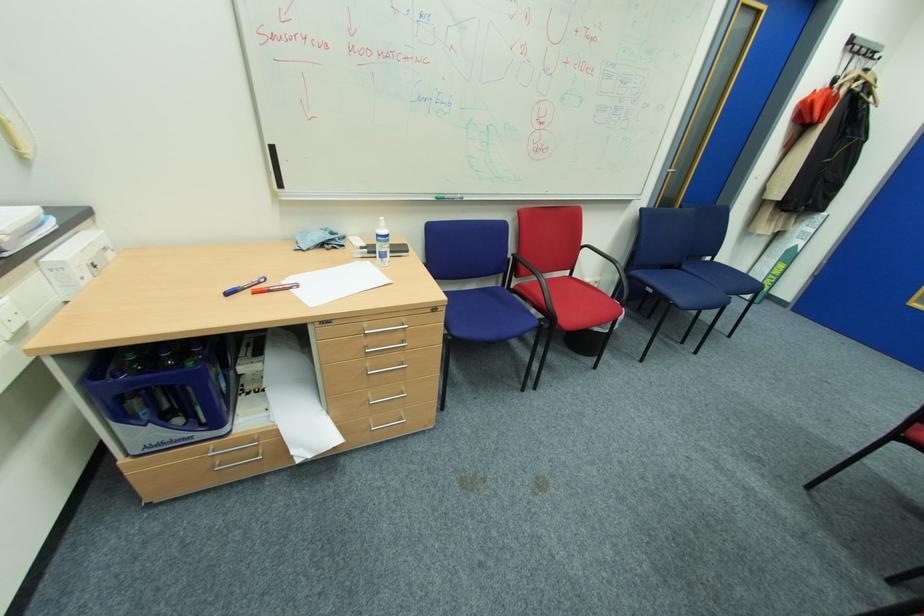
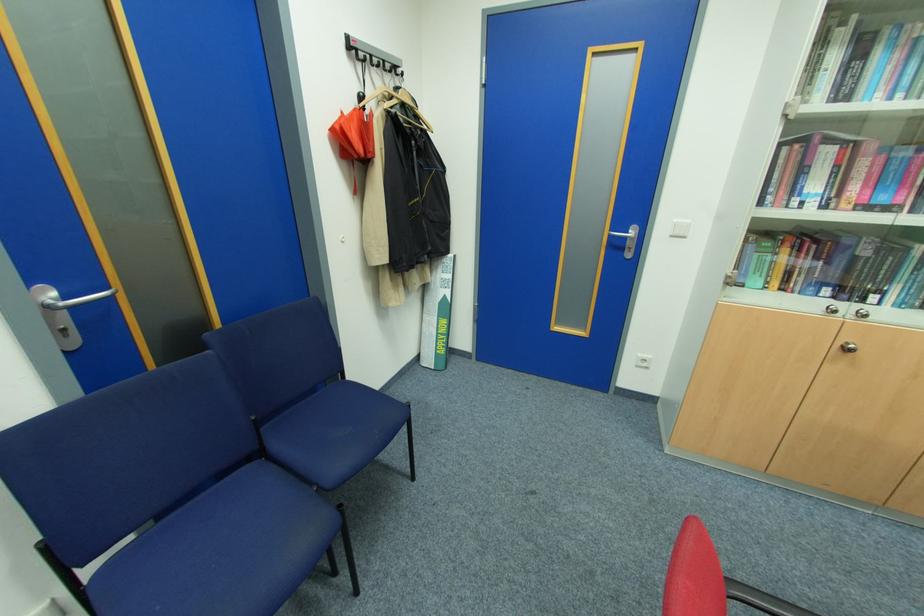
The point at (x=812, y=100) is marked in the first image. Where is the corresponding point in the second image?

(341, 127)